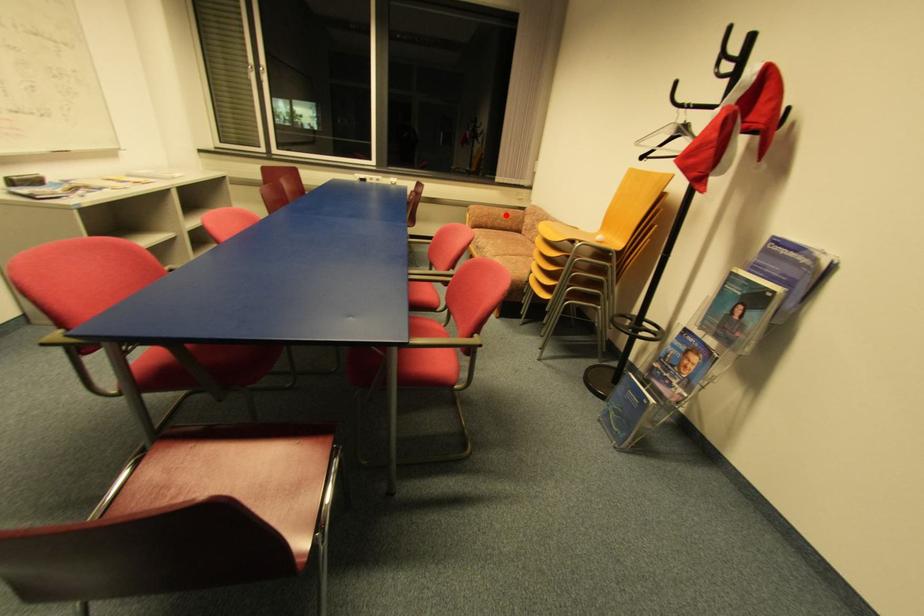
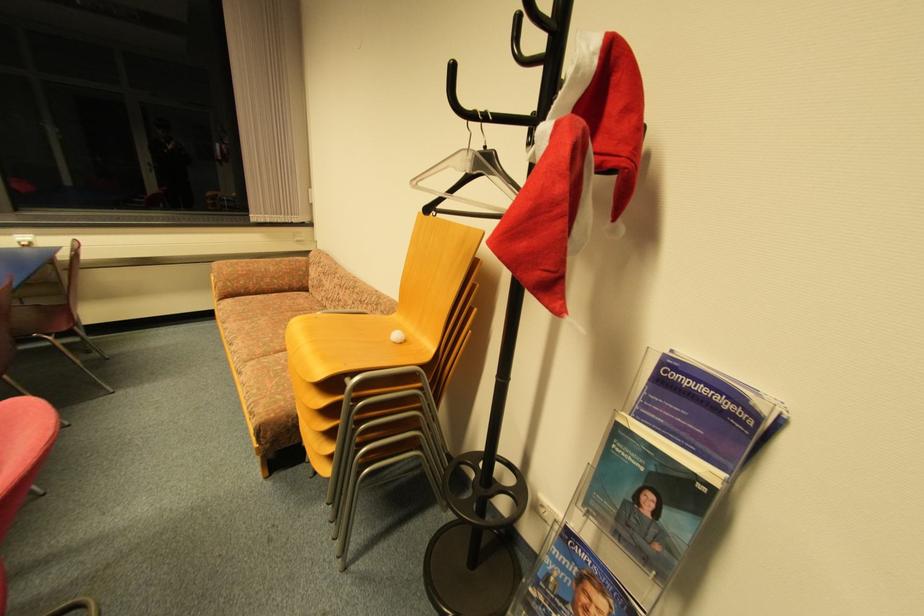
In the second image, find the point that corresponds to the highlighted location in the first image.

(275, 270)